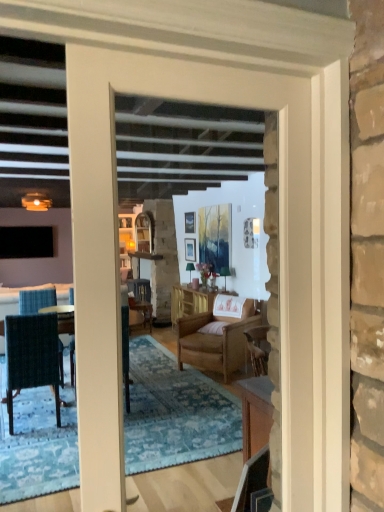
The width and height of the screenshot is (384, 512). I want to click on wooden armchair at center, acting as the second chair starting from the front, so click(x=217, y=339).

Describe the element at coordinates (192, 301) in the screenshot. The height and width of the screenshot is (512, 384). I see `wooden cabinet at center` at that location.

Image resolution: width=384 pixels, height=512 pixels. What are the coordinates of `wooden cabinet at center` in the screenshot? It's located at (192, 301).

Image resolution: width=384 pixels, height=512 pixels. I want to click on light pink fabric pillow at center, so click(x=213, y=328).

Describe the element at coordinates (32, 356) in the screenshot. I see `dark blue woven chair at left, which ranks as the 1th chair in left-to-right order` at that location.

Where is `dark blue woven chair at left, the third chair in the right-to-left sequence`? dark blue woven chair at left, the third chair in the right-to-left sequence is located at coordinates (32, 356).

Locate an element on the screen. This screenshot has width=384, height=512. white wood door at center is located at coordinates (118, 255).

Measure the distance between point (193, 223) and camera.

Point (193, 223) is 21.62 feet from camera.

What do you see at coordinates (190, 222) in the screenshot? The image size is (384, 512). I see `wooden picture frame at upper center, the first picture frame viewed from the top` at bounding box center [190, 222].

Where is `matte white picture frame at upper center, which appears as the second picture frame when viewed from the top`? matte white picture frame at upper center, which appears as the second picture frame when viewed from the top is located at coordinates (190, 249).

Is matte gold lamp at upper left oriented towards wooden cabinet at center?

No.

Is matte gold lamp at upper left smaller than wooden cabinet at center?

Correct, matte gold lamp at upper left occupies less space than wooden cabinet at center.

Is matte gold lamp at upper left not within wooden cabinet at center?

Yes, matte gold lamp at upper left is outside of wooden cabinet at center.

Is wooden armchair at center, acting as the second chair starting from the front, inside matte gold lamp at upper left?

No, wooden armchair at center, acting as the second chair starting from the front, is located outside of matte gold lamp at upper left.

Are matte gold lamp at upper left and wooden armchair at center, acting as the second chair starting from the front, located far from each other?

matte gold lamp at upper left is positioned a significant distance from wooden armchair at center, acting as the second chair starting from the front.

From a real-world perspective, which object stands above the other?

matte gold lamp at upper left.

From the picture: Based on their positions, is matte gold lamp at upper left located to the left or right of wooden armchair at center, placed as the third chair when sorted from left to right?

Clearly, matte gold lamp at upper left is on the left of wooden armchair at center, placed as the third chair when sorted from left to right, in the image.

From the image's perspective, which one is positioned lower, matte gold lamp at upper left or dark blue woven chair at left, which is the first chair in front-to-back order?

From the image's view, dark blue woven chair at left, which is the first chair in front-to-back order, is below.

Is matte gold lamp at upper left positioned in front of dark blue woven chair at left, the third chair in the right-to-left sequence?

No, matte gold lamp at upper left is behind dark blue woven chair at left, the third chair in the right-to-left sequence.

Considering the sizes of objects matte gold lamp at upper left and dark blue woven chair at left, arranged as the third chair when viewed from the back, in the image provided, who is wider, matte gold lamp at upper left or dark blue woven chair at left, arranged as the third chair when viewed from the back,?

dark blue woven chair at left, arranged as the third chair when viewed from the back.

Consider the image. Would you say matte gold lamp at upper left is to the left or to the right of dark blue woven chair at left, which is the first chair in front-to-back order, in the picture?

Clearly, matte gold lamp at upper left is on the left of dark blue woven chair at left, which is the first chair in front-to-back order, in the image.

Does matte white picture frame at upper center, which appears as the second picture frame when viewed from the top, have a lesser width compared to wooden chair at center, arranged as the 2th chair when viewed from the right?

Correct, the width of matte white picture frame at upper center, which appears as the second picture frame when viewed from the top, is less than that of wooden chair at center, arranged as the 2th chair when viewed from the right.

From the image's perspective, does matte white picture frame at upper center, the 1th picture frame in the bottom-to-top sequence, appear higher than wooden chair at center, arranged as the 2th chair when viewed from the right?

Yes, from the image's perspective, matte white picture frame at upper center, the 1th picture frame in the bottom-to-top sequence, is above wooden chair at center, arranged as the 2th chair when viewed from the right.

Does matte white picture frame at upper center, the 1th picture frame in the bottom-to-top sequence, appear on the left side of wooden chair at center, positioned as the 1th chair in back-to-front order?

No, matte white picture frame at upper center, the 1th picture frame in the bottom-to-top sequence, is not to the left of wooden chair at center, positioned as the 1th chair in back-to-front order.

Which point is more distant from viewer, [185,253] or [147,321]?

The point [147,321] is more distant.

Between light pink fabric pillow at center and wooden armchair at center, the 1th chair in the right-to-left sequence, which one has larger width?

wooden armchair at center, the 1th chair in the right-to-left sequence, is wider.

Considering the positions of points (212, 325) and (236, 340), is point (212, 325) closer to camera compared to point (236, 340)?

No, it is behind (236, 340).

You are a GUI agent. You are given a task and a screenshot of the screen. Output one action in this format:
    pyautogui.click(x=<x>, y=<y>)
    Task: Click on the pillow behind the wooden armchair at center, placed as the third chair when sorted from left to right
    The height and width of the screenshot is (512, 384).
    Given the screenshot: What is the action you would take?
    pyautogui.click(x=213, y=328)

Is dark blue woven chair at left, arranged as the third chair when viewed from the back, turned away from wooden armchair at center, the 1th chair in the right-to-left sequence?

No, dark blue woven chair at left, arranged as the third chair when viewed from the back, is not facing the opposite direction of wooden armchair at center, the 1th chair in the right-to-left sequence.

Does dark blue woven chair at left, the third chair in the right-to-left sequence, have a lesser height compared to wooden armchair at center, placed as the third chair when sorted from left to right?

No.

Is dark blue woven chair at left, which ranks as the 1th chair in left-to-right order, wider than wooden armchair at center, which is the second chair in back-to-front order?

Incorrect, the width of dark blue woven chair at left, which ranks as the 1th chair in left-to-right order, does not surpass that of wooden armchair at center, which is the second chair in back-to-front order.

From a real-world perspective, is dark blue woven chair at left, which ranks as the 1th chair in left-to-right order, positioned over wooden armchair at center, which is the second chair in back-to-front order, based on gravity?

Yes, from a real-world perspective, dark blue woven chair at left, which ranks as the 1th chair in left-to-right order, is over wooden armchair at center, which is the second chair in back-to-front order

Is light pink fabric pillow at center positioned beyond the bounds of wooden chair at center, positioned as the 1th chair in back-to-front order?

That's correct, light pink fabric pillow at center is outside of wooden chair at center, positioned as the 1th chair in back-to-front order.

Considering the sizes of objects light pink fabric pillow at center and wooden chair at center, arranged as the 2th chair when viewed from the right, in the image provided, who is bigger, light pink fabric pillow at center or wooden chair at center, arranged as the 2th chair when viewed from the right,?

wooden chair at center, arranged as the 2th chair when viewed from the right, is bigger.

From the image's perspective, is light pink fabric pillow at center positioned above or below wooden chair at center, acting as the second chair starting from the left?

From the image's perspective, light pink fabric pillow at center appears above wooden chair at center, acting as the second chair starting from the left.

Is wooden chair at center, positioned as the 1th chair in back-to-front order, at the back of light pink fabric pillow at center?

No, light pink fabric pillow at center is not facing away from wooden chair at center, positioned as the 1th chair in back-to-front order.

I want to click on cabinetry below the matte gold lamp at upper left (from a real-world perspective), so click(x=192, y=301).

Where is `lamp above the wooden armchair at center, the 1th chair in the right-to-left sequence (from the image's perspective)`? This screenshot has width=384, height=512. lamp above the wooden armchair at center, the 1th chair in the right-to-left sequence (from the image's perspective) is located at coordinates (36, 202).

From the image, which object appears to be nearer to light pink fabric pillow at center, matte white picture frame at upper center, the 1th picture frame in the bottom-to-top sequence, or wooden chair at center, which appears as the 3th chair when viewed from the front?

matte white picture frame at upper center, the 1th picture frame in the bottom-to-top sequence, is positioned closer to the anchor light pink fabric pillow at center.

Looking at the image, which one is located closer to wooden armchair at center, placed as the third chair when sorted from left to right, matte gold lamp at upper left or wooden cabinet at center?

wooden cabinet at center.

Based on their spatial positions, is white wood door at center or light pink fabric pillow at center further from wooden cabinet at center?

Based on the image, white wood door at center appears to be further to wooden cabinet at center.

When comparing their distances from matte white picture frame at upper center, which appears as the second picture frame when viewed from the top, does wooden chair at center, positioned as the 1th chair in back-to-front order, or white wood door at center seem closer?

wooden chair at center, positioned as the 1th chair in back-to-front order, is positioned closer to the anchor matte white picture frame at upper center, which appears as the second picture frame when viewed from the top.

Which object lies nearer to the anchor point matte gold lamp at upper left, wooden chair at center, arranged as the 2th chair when viewed from the right, or wooden armchair at center, which is the second chair in back-to-front order?

wooden chair at center, arranged as the 2th chair when viewed from the right, lies closer to matte gold lamp at upper left than the other object.

Based on their spatial positions, is white wood door at center or light pink fabric pillow at center further from wooden chair at center, acting as the second chair starting from the left?

white wood door at center lies further to wooden chair at center, acting as the second chair starting from the left, than the other object.

Looking at this image, considering their positions, is light pink fabric pillow at center positioned further to wooden picture frame at upper center, the first picture frame viewed from the top, than wooden armchair at center, placed as the third chair when sorted from left to right?

The object further to wooden picture frame at upper center, the first picture frame viewed from the top, is wooden armchair at center, placed as the third chair when sorted from left to right.

Estimate the real-world distances between objects in this image. Which object is further from light pink fabric pillow at center, wooden chair at center, positioned as the 1th chair in back-to-front order, or matte white picture frame at upper center, the 1th picture frame in the bottom-to-top sequence?

The object further to light pink fabric pillow at center is wooden chair at center, positioned as the 1th chair in back-to-front order.

Where is `pillow positioned between dark blue woven chair at left, which is the first chair in front-to-back order, and wooden cabinet at center from near to far`? Image resolution: width=384 pixels, height=512 pixels. pillow positioned between dark blue woven chair at left, which is the first chair in front-to-back order, and wooden cabinet at center from near to far is located at coordinates (213, 328).

Where is `pillow between wooden armchair at center, the 1th chair in the right-to-left sequence, and wooden picture frame at upper center, which is the second picture frame in bottom-to-top order, from front to back`? The width and height of the screenshot is (384, 512). pillow between wooden armchair at center, the 1th chair in the right-to-left sequence, and wooden picture frame at upper center, which is the second picture frame in bottom-to-top order, from front to back is located at coordinates (213, 328).

Locate an element on the screen. The width and height of the screenshot is (384, 512). lamp between dark blue woven chair at left, the third chair in the right-to-left sequence, and matte white picture frame at upper center, the 1th picture frame in the bottom-to-top sequence, along the z-axis is located at coordinates (36, 202).

Locate an element on the screen. Image resolution: width=384 pixels, height=512 pixels. pillow located between white wood door at center and matte white picture frame at upper center, the 1th picture frame in the bottom-to-top sequence, in the depth direction is located at coordinates (213, 328).